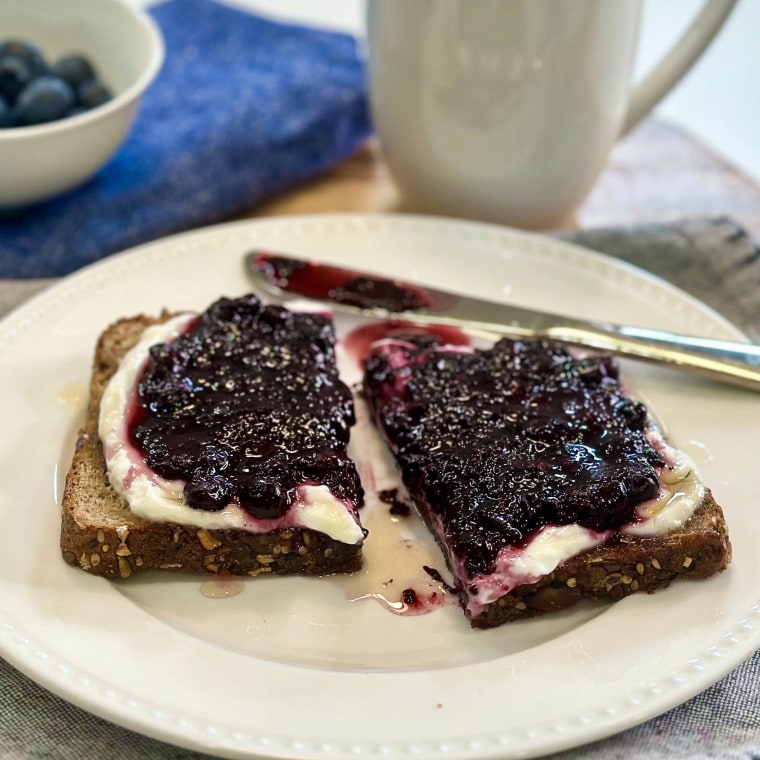
Image resolution: width=760 pixels, height=760 pixels. I want to click on ceramic dishes, so click(x=444, y=724), click(x=469, y=133), click(x=115, y=68).